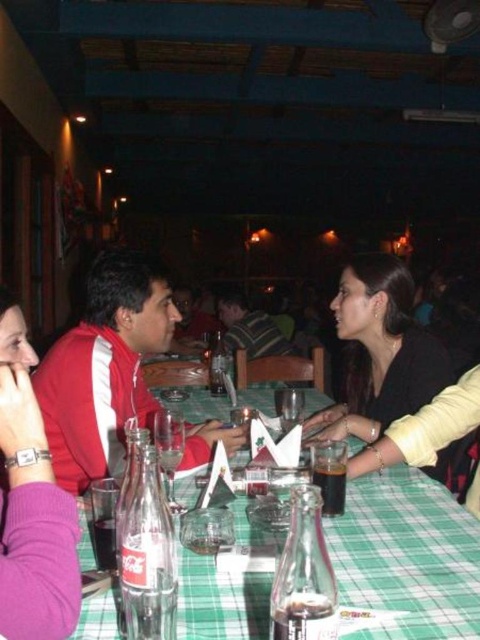
Does green checkered tablecloth at center have a greater width compared to striped fabric shirt at center?

Yes, green checkered tablecloth at center is wider than striped fabric shirt at center.

Looking at this image, is green checkered tablecloth at center below striped fabric shirt at center?

Indeed, green checkered tablecloth at center is positioned under striped fabric shirt at center.

Is point (197, 397) closer to camera compared to point (242, 337)?

Yes.

Find the location of a particular element. green checkered tablecloth at center is located at coordinates (408, 556).

Between black matte jacket at center and striped fabric shirt at center, which one has less height?

Standing shorter between the two is striped fabric shirt at center.

Does point (420, 330) come behind point (240, 339)?

That is False.

Locate an element on the screen. The height and width of the screenshot is (640, 480). black matte jacket at center is located at coordinates (380, 352).

The height and width of the screenshot is (640, 480). Describe the element at coordinates (32, 508) in the screenshot. I see `purple fabric shirt at left` at that location.

Does purple fabric shirt at left have a lesser height compared to black matte jacket at center?

Correct, purple fabric shirt at left is not as tall as black matte jacket at center.

Is point (68, 630) positioned in front of point (347, 408)?

That is True.

Identify the location of purple fabric shirt at left. (32, 508).